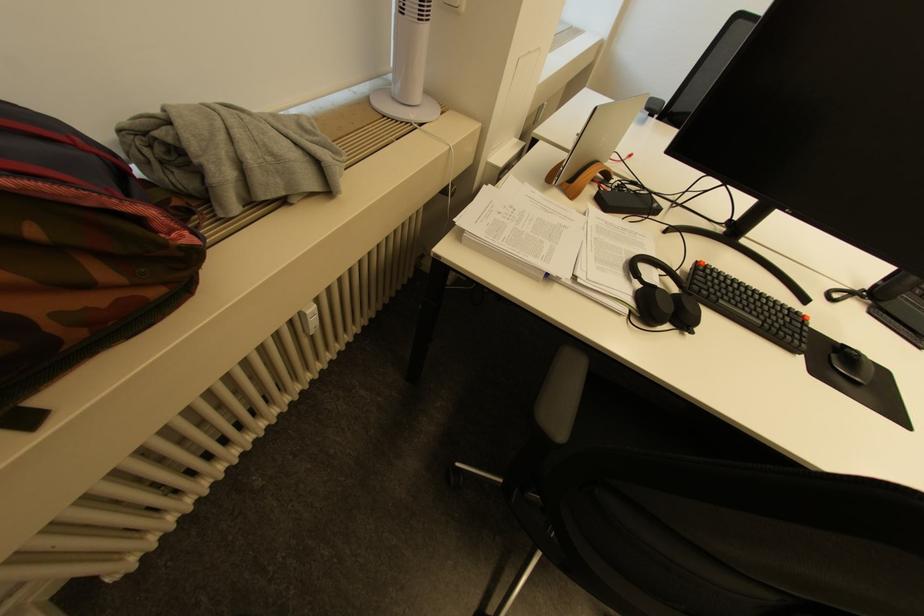
What do you see at coordinates (561, 392) in the screenshot?
I see `the chair armrest` at bounding box center [561, 392].